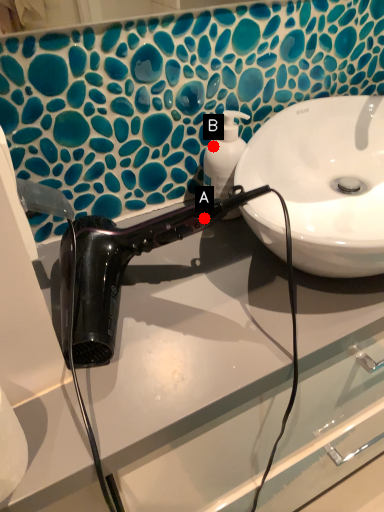
Question: Two points are circled on the image, labeled by A and B beside each circle. Which point is closer to the camera taking this photo?

Choices:
 (A) A is closer
 (B) B is closer

Answer: (A)